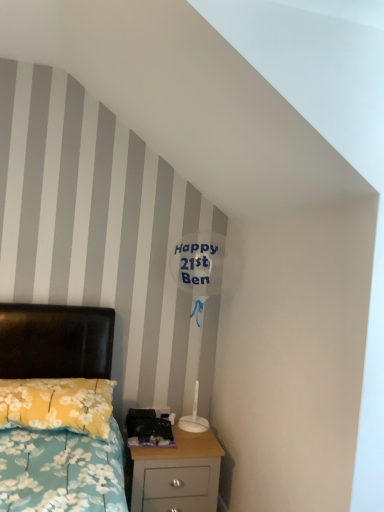
Measure the distance between yellow floral fabric pillow at lower left and camera.

A distance of 1.74 meters exists between yellow floral fabric pillow at lower left and camera.

This screenshot has height=512, width=384. Find the location of `light wood nightstand at lower right`. light wood nightstand at lower right is located at coordinates (177, 474).

Measure the distance between transparent plastic balloon at upper center and yellow floral fabric pillow at lower left.

transparent plastic balloon at upper center and yellow floral fabric pillow at lower left are 32.08 inches apart.

This screenshot has height=512, width=384. I want to click on table lamp above the yellow floral fabric pillow at lower left (from a real-world perspective), so click(x=200, y=309).

From the image's perspective, relative to yellow floral fabric pillow at lower left, is transparent plastic balloon at upper center above or below?

Based on their image positions, transparent plastic balloon at upper center is located above yellow floral fabric pillow at lower left.

Which is in front, light wood nightstand at lower right or transparent plastic balloon at upper center?

light wood nightstand at lower right is closer to the camera.

Is transparent plastic balloon at upper center located within light wood nightstand at lower right?

No, light wood nightstand at lower right does not contain transparent plastic balloon at upper center.

What's the angular difference between light wood nightstand at lower right and transparent plastic balloon at upper center's facing directions?

There is a 0.147-degree angle between the facing directions of light wood nightstand at lower right and transparent plastic balloon at upper center.

Based on the photo, is light wood nightstand at lower right not near transparent plastic balloon at upper center?

No, light wood nightstand at lower right is in close proximity to transparent plastic balloon at upper center.

Considering the sizes of objects light wood nightstand at lower right and yellow floral fabric pillow at lower left in the image provided, who is smaller, light wood nightstand at lower right or yellow floral fabric pillow at lower left?

Smaller between the two is yellow floral fabric pillow at lower left.

Is light wood nightstand at lower right facing away from yellow floral fabric pillow at lower left?

light wood nightstand at lower right is not turned away from yellow floral fabric pillow at lower left.

Based on the photo, from the image's perspective, is light wood nightstand at lower right above or below yellow floral fabric pillow at lower left?

Clearly, from the image's perspective, light wood nightstand at lower right is below yellow floral fabric pillow at lower left.

Is light wood nightstand at lower right surrounding yellow floral fabric pillow at lower left?

No, yellow floral fabric pillow at lower left is not inside light wood nightstand at lower right.

Would you say transparent plastic balloon at upper center is to the left or to the right of light wood nightstand at lower right in the picture?

transparent plastic balloon at upper center is to the right of light wood nightstand at lower right.

Does point (200, 366) lie in front of point (147, 450)?

That is False.

Which is more to the left, yellow floral fabric pillow at lower left or transparent plastic balloon at upper center?

yellow floral fabric pillow at lower left.

Consider the image. Which point is more forward, (x=91, y=405) or (x=212, y=356)?

Point (x=91, y=405)

Would you say yellow floral fabric pillow at lower left is a long distance from transparent plastic balloon at upper center?

yellow floral fabric pillow at lower left is near transparent plastic balloon at upper center, not far away.

Can you confirm if yellow floral fabric pillow at lower left is thinner than transparent plastic balloon at upper center?

No, yellow floral fabric pillow at lower left is not thinner than transparent plastic balloon at upper center.

From the picture: Between yellow floral fabric pillow at lower left and light wood nightstand at lower right, which one has smaller width?

With smaller width is light wood nightstand at lower right.

Can you confirm if yellow floral fabric pillow at lower left is smaller than light wood nightstand at lower right?

Correct, yellow floral fabric pillow at lower left occupies less space than light wood nightstand at lower right.

In the scene shown: Does yellow floral fabric pillow at lower left touch light wood nightstand at lower right?

No, yellow floral fabric pillow at lower left is not making contact with light wood nightstand at lower right.

Does yellow floral fabric pillow at lower left turn towards light wood nightstand at lower right?

No, yellow floral fabric pillow at lower left does not turn towards light wood nightstand at lower right.

Image resolution: width=384 pixels, height=512 pixels. I want to click on table lamp that appears above the yellow floral fabric pillow at lower left (from a real-world perspective), so click(200, 309).

Where is `nightstand beneath the transparent plastic balloon at upper center (from a real-world perspective)`? The height and width of the screenshot is (512, 384). nightstand beneath the transparent plastic balloon at upper center (from a real-world perspective) is located at coordinates (177, 474).

Considering their positions, is yellow floral fabric pillow at lower left positioned closer to light wood nightstand at lower right than transparent plastic balloon at upper center?

yellow floral fabric pillow at lower left lies closer to light wood nightstand at lower right than the other object.

Estimate the real-world distances between objects in this image. Which object is further from yellow floral fabric pillow at lower left, light wood nightstand at lower right or transparent plastic balloon at upper center?

Based on the image, transparent plastic balloon at upper center appears to be further to yellow floral fabric pillow at lower left.

Looking at this image, when comparing their distances from transparent plastic balloon at upper center, does light wood nightstand at lower right or yellow floral fabric pillow at lower left seem closer?

The object closer to transparent plastic balloon at upper center is light wood nightstand at lower right.

From the image, which object appears to be farther from yellow floral fabric pillow at lower left, transparent plastic balloon at upper center or light wood nightstand at lower right?

The object further to yellow floral fabric pillow at lower left is transparent plastic balloon at upper center.

Consider the image. From the image, which object appears to be farther from transparent plastic balloon at upper center, yellow floral fabric pillow at lower left or light wood nightstand at lower right?

Among the two, yellow floral fabric pillow at lower left is located further to transparent plastic balloon at upper center.

Which object lies nearer to the anchor point light wood nightstand at lower right, transparent plastic balloon at upper center or yellow floral fabric pillow at lower left?

Based on the image, yellow floral fabric pillow at lower left appears to be nearer to light wood nightstand at lower right.

The width and height of the screenshot is (384, 512). Find the location of `pillow between transparent plastic balloon at upper center and light wood nightstand at lower right vertically`. pillow between transparent plastic balloon at upper center and light wood nightstand at lower right vertically is located at coordinates (57, 404).